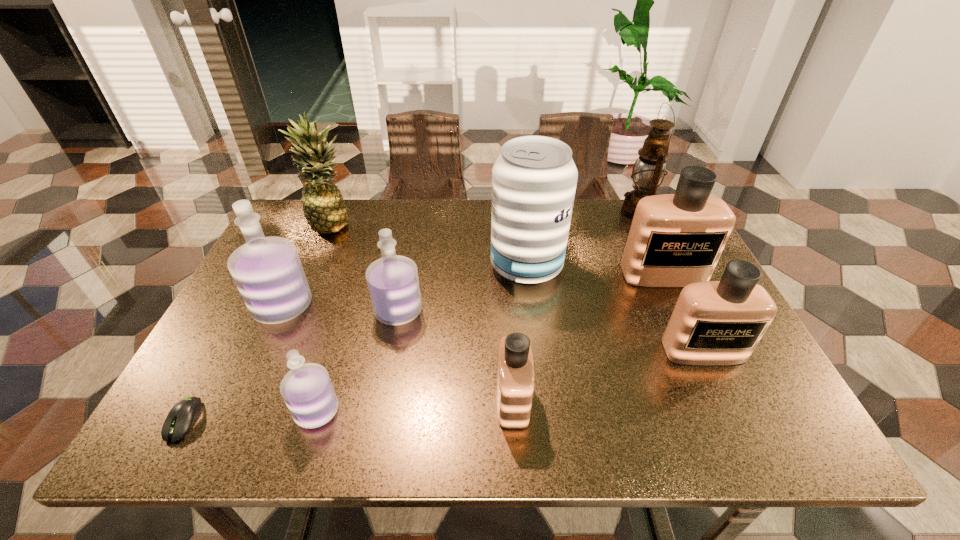
Where is `computer mouse that is at the near edge`? The image size is (960, 540). computer mouse that is at the near edge is located at coordinates (184, 414).

You are a GUI agent. You are given a task and a screenshot of the screen. Output one action in this format:
    pyautogui.click(x=<x>, y=<y>)
    Task: Click on the pineapple positioned at the left edge
    
    Given the screenshot: What is the action you would take?
    pyautogui.click(x=324, y=208)

The image size is (960, 540). I want to click on perfume that is at the left edge, so click(x=268, y=273).

I want to click on computer mouse at the left edge, so click(x=184, y=414).

Where is `oil lamp present at the right edge`? oil lamp present at the right edge is located at coordinates (648, 172).

The image size is (960, 540). What are the coordinates of `object present at the far left corner` in the screenshot? It's located at (324, 208).

Find the location of a particular element. The height and width of the screenshot is (540, 960). object at the near left corner is located at coordinates (184, 414).

Where is `object that is at the far right corner`? object that is at the far right corner is located at coordinates (648, 172).

Locate an element on the screen. The width and height of the screenshot is (960, 540). free point at the far edge is located at coordinates (477, 202).

Where is `free space at the near edge`? This screenshot has width=960, height=540. free space at the near edge is located at coordinates (478, 438).